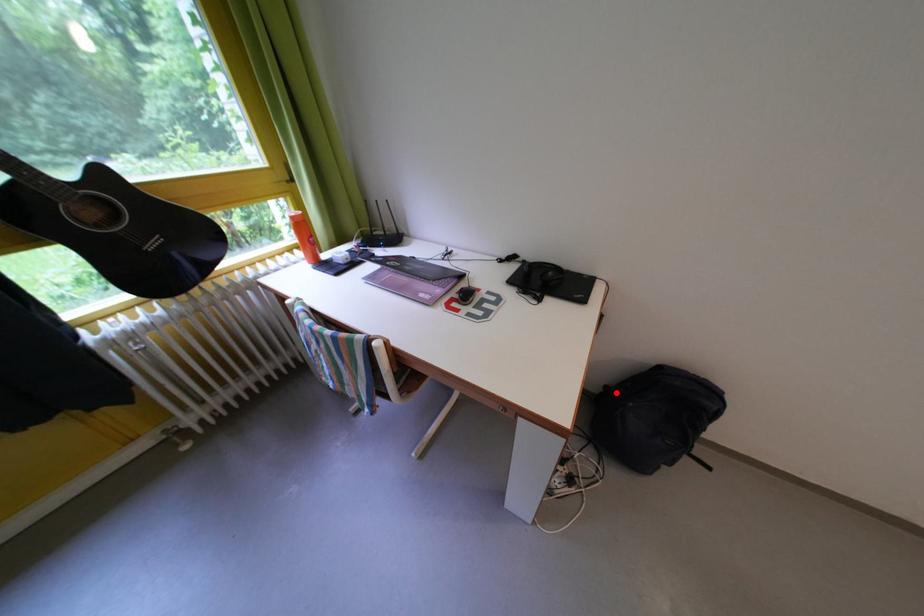
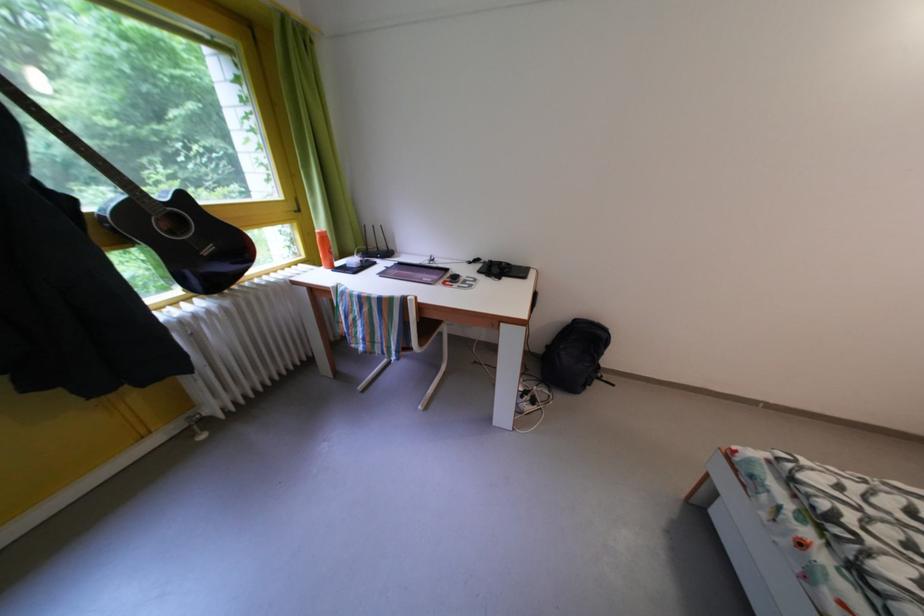
Question: I am providing you with two images of the same scene from different viewpoints. A red point is shown in image1. For the corresponding object point in image2, is it positioned nearer or farther from the camera?

Choices:
 (A) Nearer
 (B) Farther

Answer: (A)